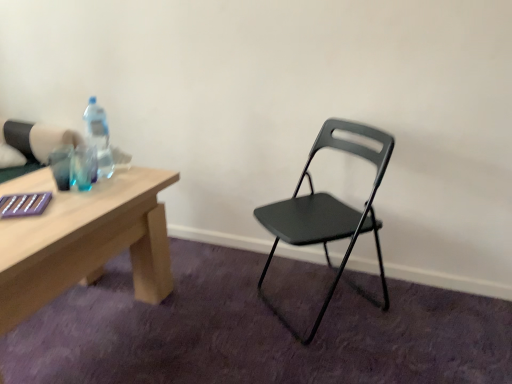
The image size is (512, 384). I want to click on blank space to the left of matte black folding chair at center, so click(x=208, y=317).